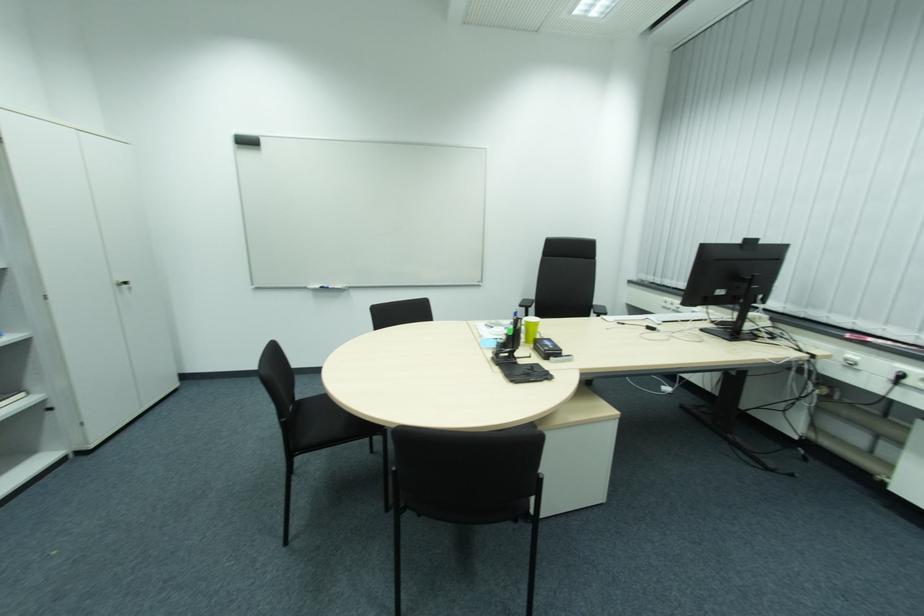
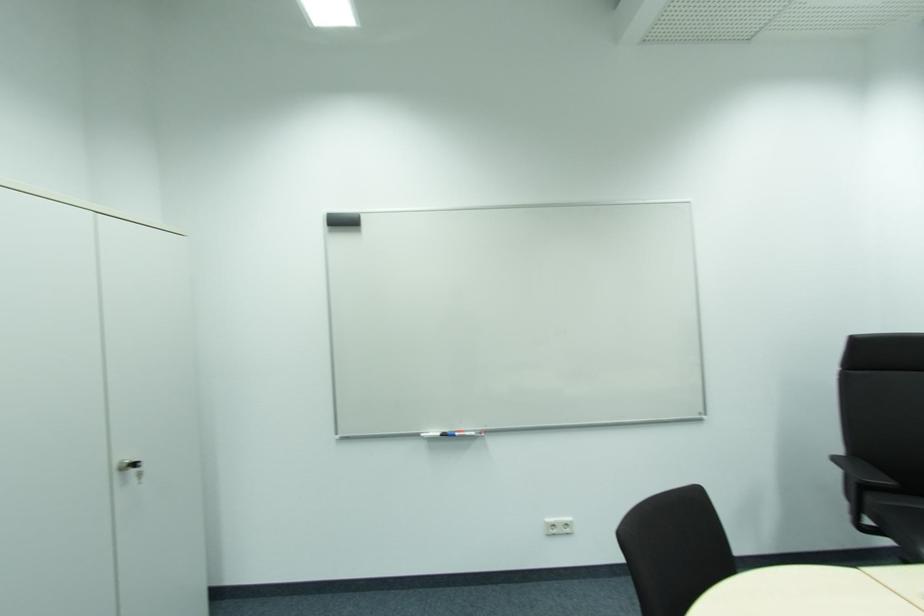
Where in the second image is the point corresponding to the point at 335,288 from the first image?

(464, 434)